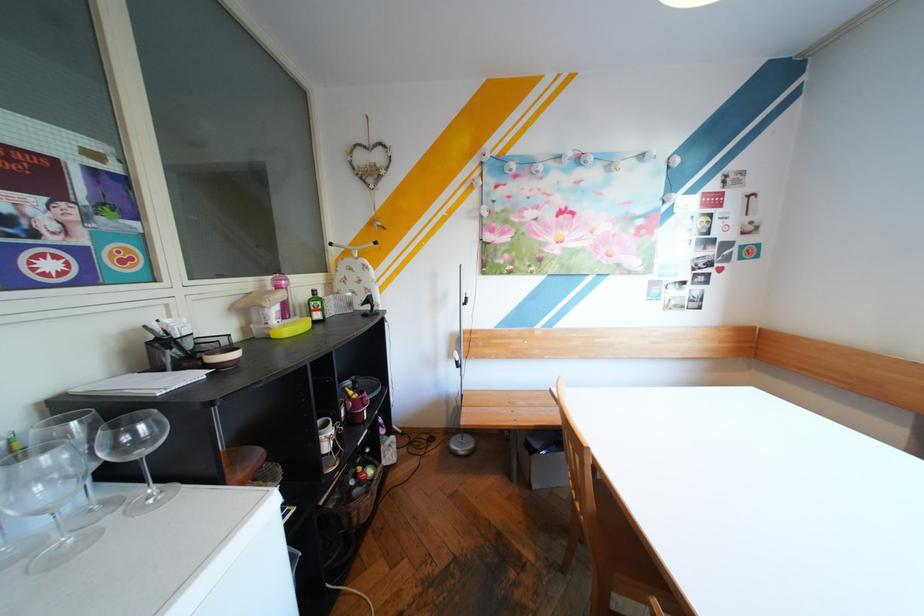
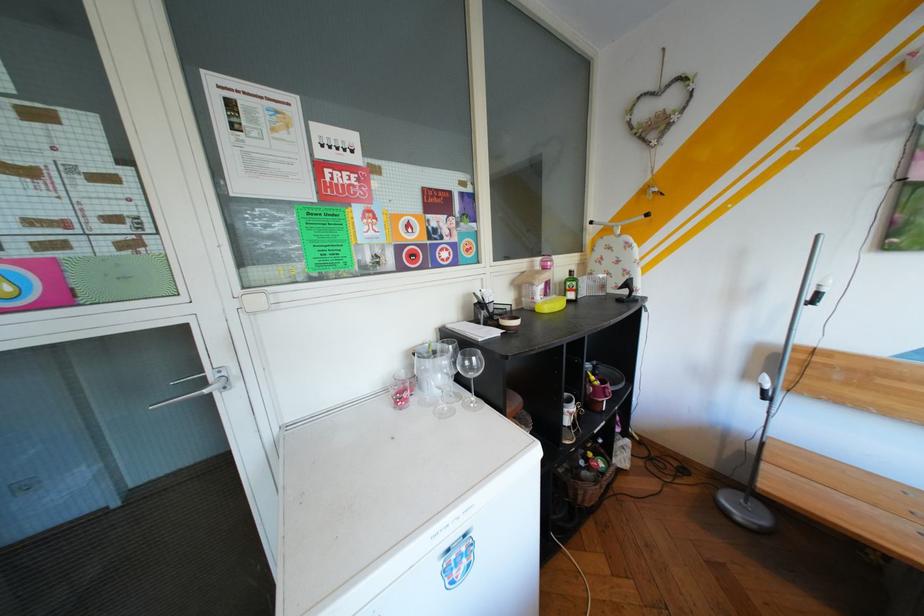
Locate, in the second image, the point that corresponds to pixel 202 361 in the first image.

(505, 320)